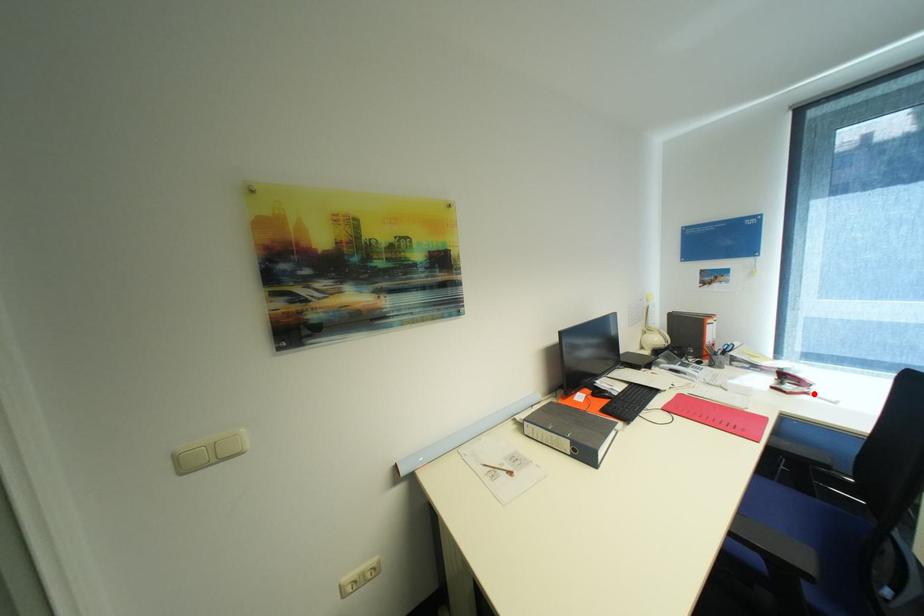
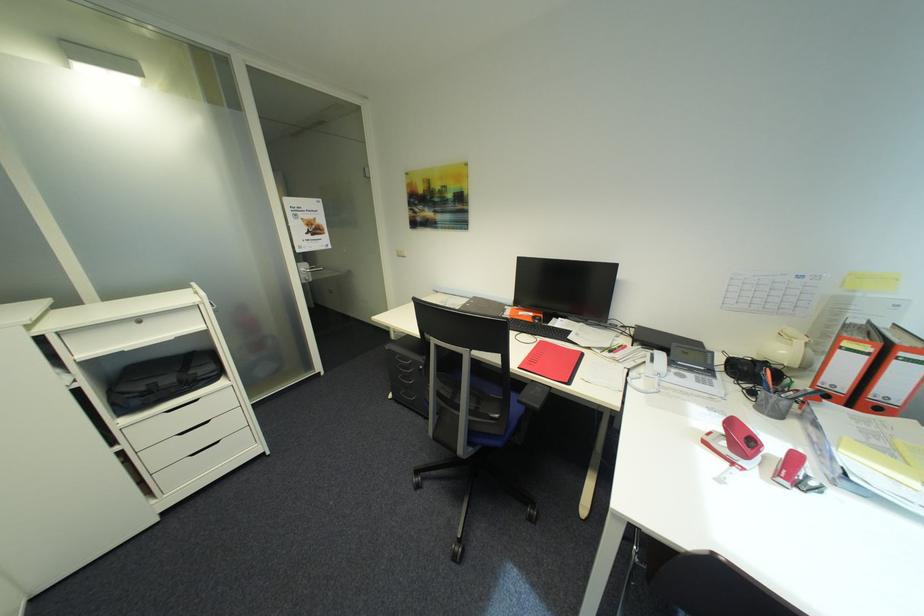
Locate, in the second image, the point that corresponds to the highlighted location in the first image.

(742, 464)